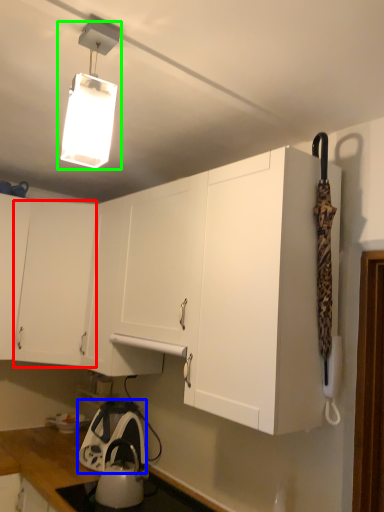
Question: Which is nearer to the cabinetry (highlighted by a red box)? appliance (highlighted by a blue box) or lamp (highlighted by a green box).

Choices:
 (A) appliance
 (B) lamp

Answer: (A)